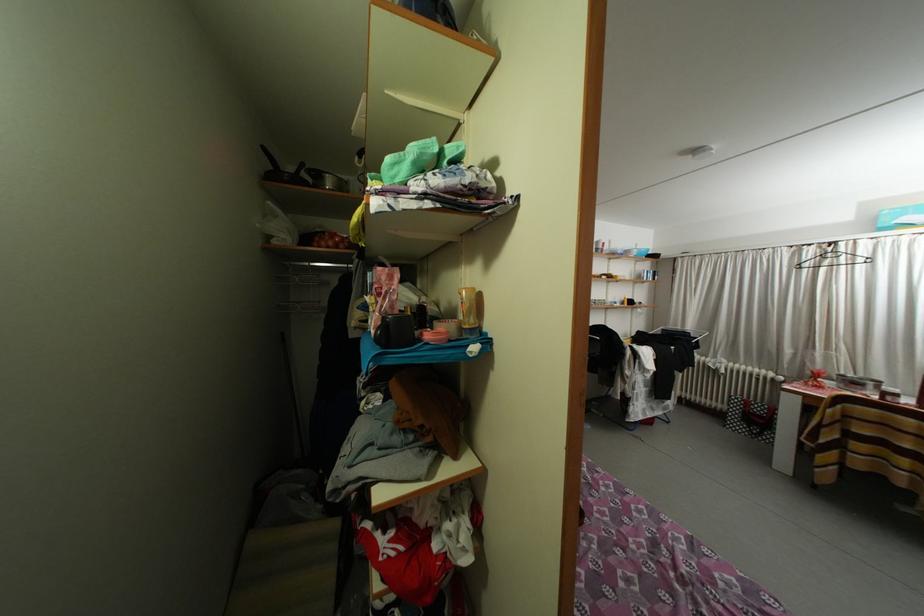
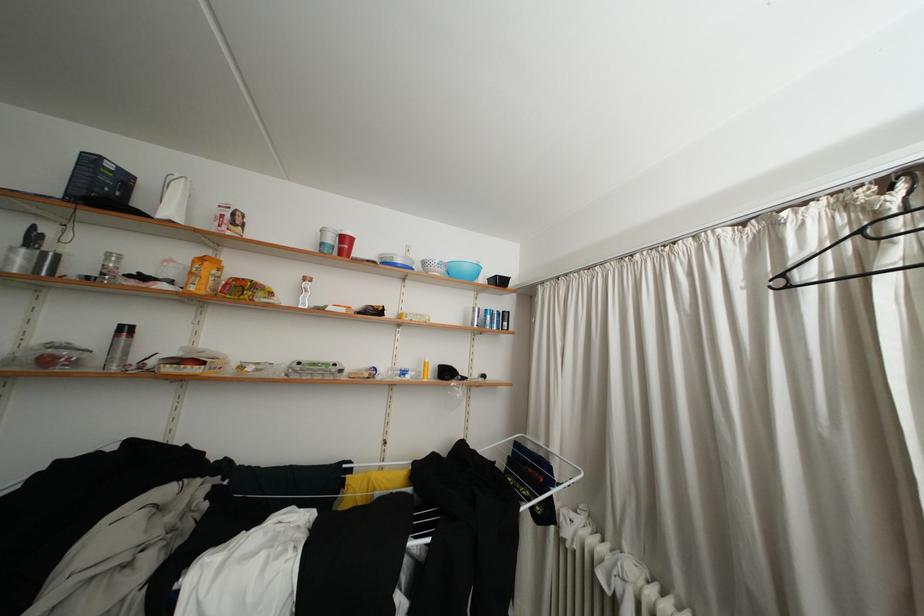
In the second image, find the point that corresponds to [687,333] in the first image.

(550, 448)